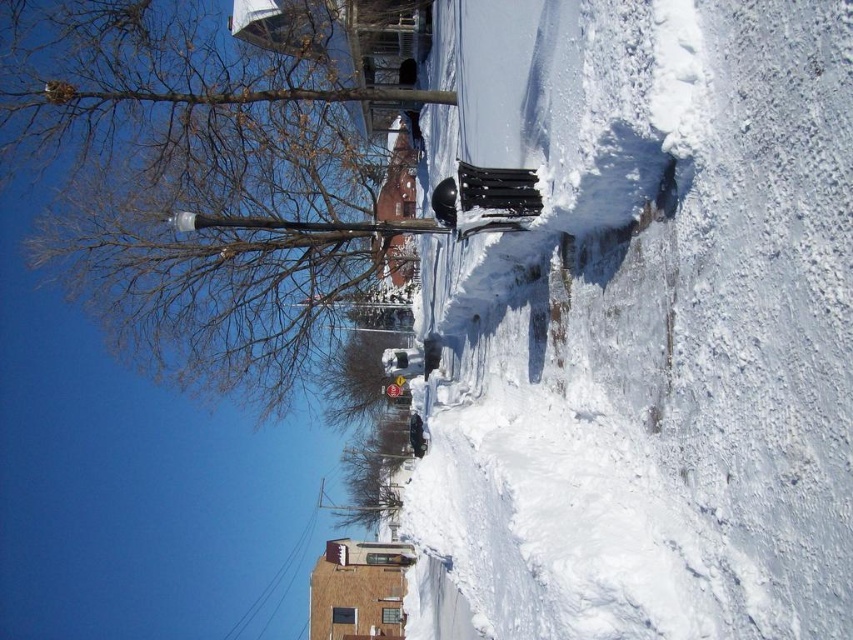
Consider the image. You are a city worker who needs to place a new snow removal sign. The sign must be placed on an object that is taller than the other. Which object should you choose between the black plastic trash can at center and the brown bark tree at upper left?

The brown bark tree at upper left is taller than the black plastic trash can at center, so the snow removal sign should be placed on the brown bark tree at upper left.

You are a snowplow operator who needs to clear the snow from the sidewalk. You see the black plastic trash can at center and the brown bark tree at upper left. Which object is closer to the ground?

The black plastic trash can at center is located below brown bark tree at upper left, so the black plastic trash can at center is closer to the ground.

You are standing on the snowy sidewalk and want to take a photo of the black plastic trash can at center and the brown bark tree at upper left. Which object will appear larger in the photo?

The black plastic trash can at center will appear larger in the photo because it is closer to the camera than the brown bark tree at upper left.